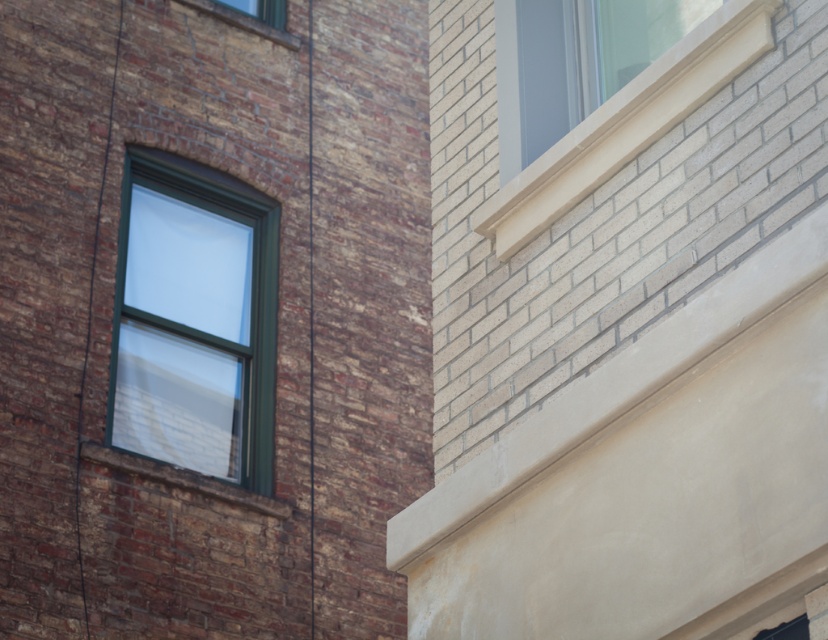
Does green glass window at left have a lesser height compared to clear glass window at upper center?

In fact, green glass window at left may be taller than clear glass window at upper center.

Between green glass window at left and clear glass window at upper center, which one appears on the left side from the viewer's perspective?

Positioned to the left is green glass window at left.

Who is more distant from viewer, (133, 260) or (238, 20)?

Point (238, 20)

Image resolution: width=828 pixels, height=640 pixels. In order to click on green glass window at left in this screenshot , I will do `click(195, 321)`.

Can you confirm if green glass window at left is shorter than white smooth window at upper right?

In fact, green glass window at left may be taller than white smooth window at upper right.

Is point (239, 424) less distant than point (600, 113)?

No.

Is point (167, 260) behind point (641, 88)?

Yes.

You are a GUI agent. You are given a task and a screenshot of the screen. Output one action in this format:
    pyautogui.click(x=<x>, y=<y>)
    Task: Click on the green glass window at left
    
    Given the screenshot: What is the action you would take?
    pyautogui.click(x=195, y=321)

Is white smooth window at upper right in front of clear glass window at upper center?

Yes.

Find the location of a particular element. This screenshot has width=828, height=640. white smooth window at upper right is located at coordinates (626, 124).